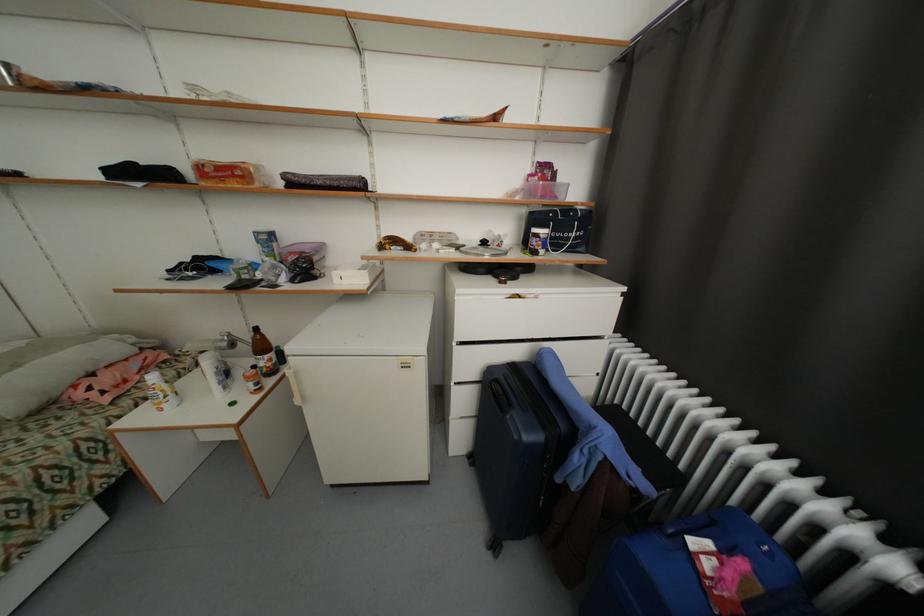
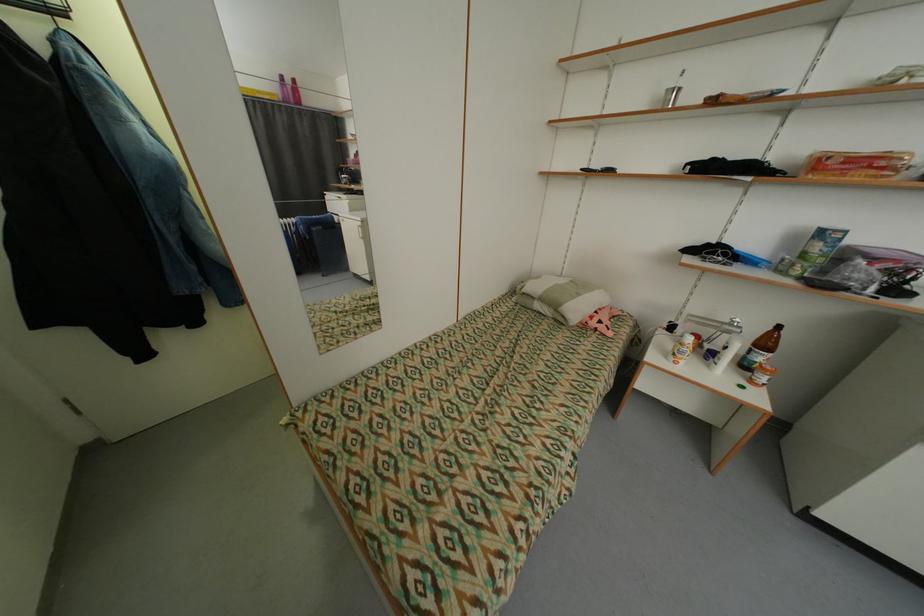
Where in the second image is the point corresponding to [86,395] from the first image?

(600, 323)